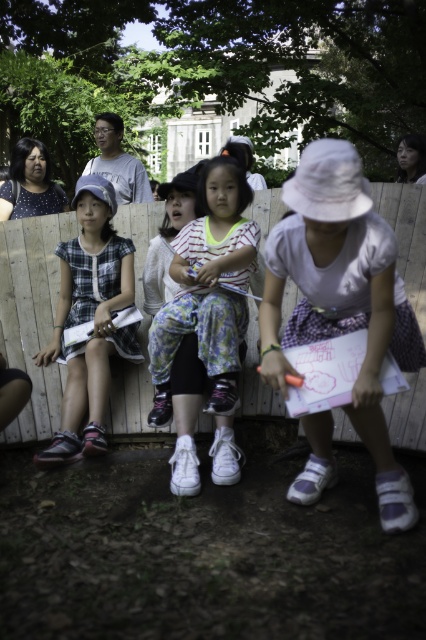
You are a photographer trying to capture a clear shot of the wooden fence at center and the white matte sneakers at center. Which object should you focus on first if you want to ensure both are in focus without adjusting the camera settings?

The wooden fence at center is smaller than the white matte sneakers at center, so focusing on the larger object first, the white matte sneakers at center, would help ensure both are in focus without needing to adjust the camera settings.

You are standing in the park and see the wooden fence at center and the white matte sneakers at center. Which object is located to the left of the other?

The wooden fence at center is positioned on the left side of white matte sneakers at center.